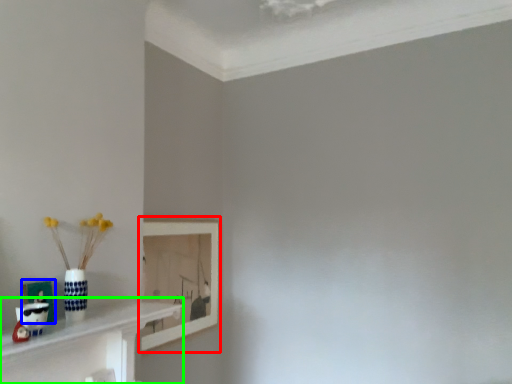
Question: Which object is positioned closest to picture frame (highlighted by a red box)? Select from picture frame (highlighted by a blue box) and shelf (highlighted by a green box).

Choices:
 (A) picture frame
 (B) shelf

Answer: (B)